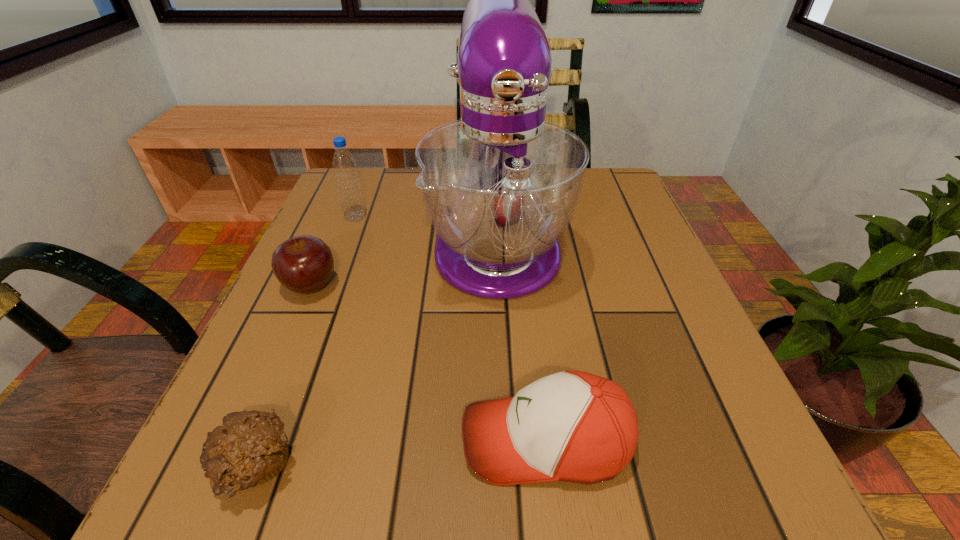
Locate an element on the screen. This screenshot has height=540, width=960. the tallest object is located at coordinates (501, 185).

The width and height of the screenshot is (960, 540). I want to click on water bottle, so click(344, 165).

Locate an element on the screen. The width and height of the screenshot is (960, 540). baseball cap is located at coordinates (572, 426).

The height and width of the screenshot is (540, 960). Identify the location of apple. (303, 264).

Where is `muffin`? This screenshot has width=960, height=540. muffin is located at coordinates (250, 449).

Where is `vacant space located 0.060m at the bowl opening of the mixer`? This screenshot has height=540, width=960. vacant space located 0.060m at the bowl opening of the mixer is located at coordinates (502, 341).

This screenshot has height=540, width=960. I want to click on free point located 0.170m on the right of the second tallest object, so click(442, 217).

Image resolution: width=960 pixels, height=540 pixels. I want to click on free spot located 0.120m on the front-facing side of the baseball cap, so click(373, 440).

The width and height of the screenshot is (960, 540). What are the coordinates of `free location located on the front-facing side of the baseball cap` in the screenshot? It's located at (350, 440).

Find the location of a particular element. vacant space located 0.180m on the front-facing side of the baseball cap is located at coordinates (328, 440).